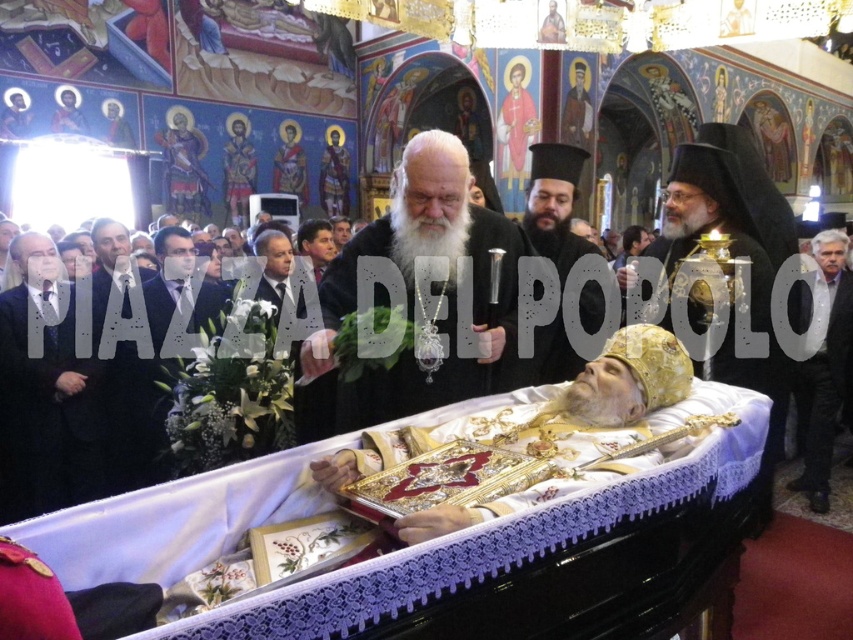
Does white bearded priest at center have a lesser width compared to gray wool suit at right?

No, white bearded priest at center is not thinner than gray wool suit at right.

Is white bearded priest at center above gray wool suit at right?

Yes, white bearded priest at center is above gray wool suit at right.

Describe the element at coordinates (413, 288) in the screenshot. I see `white bearded priest at center` at that location.

At what (x,y) coordinates should I click in order to perform the action: click on white bearded priest at center. Please return your answer as a coordinate pair (x, y). Image resolution: width=853 pixels, height=640 pixels. Looking at the image, I should click on (413, 288).

Is point (838, 294) closer to viewer compared to point (143, 284)?

No, it is behind (143, 284).

Can you confirm if gray wool suit at right is thinner than matte black suit at center?

No, gray wool suit at right is not thinner than matte black suit at center.

Describe the element at coordinates (822, 374) in the screenshot. I see `gray wool suit at right` at that location.

Identify the location of gray wool suit at right. (822, 374).

I want to click on black velvet hat at center, so click(554, 204).